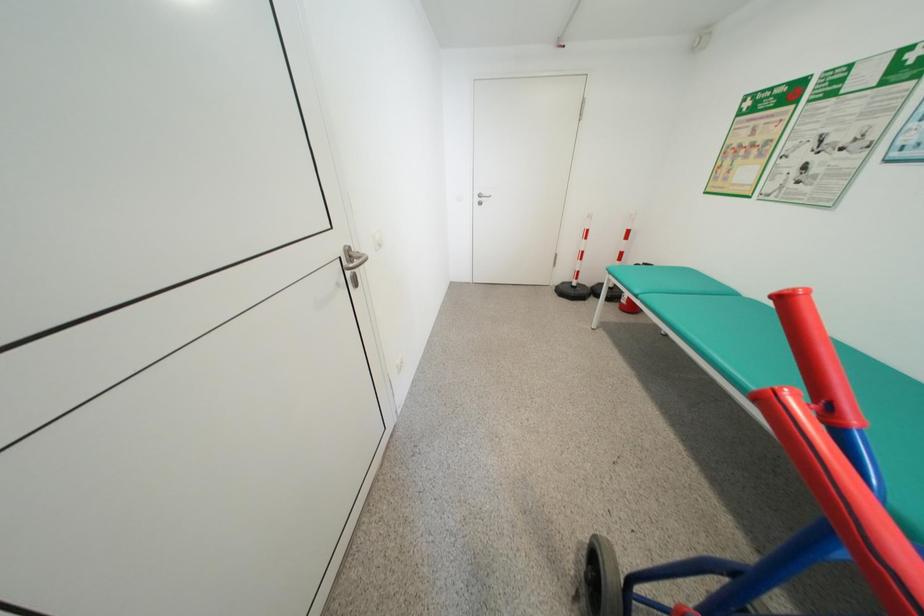
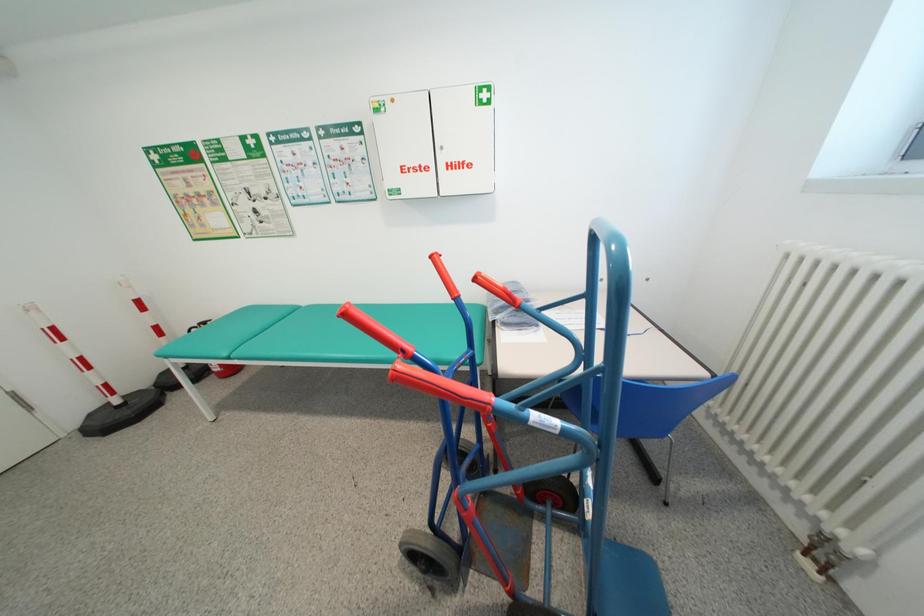
The first image is from the beginning of the video and the second image is from the end. How did the camera likely rotate when shooting the video?

The camera's rotation is toward right-down.